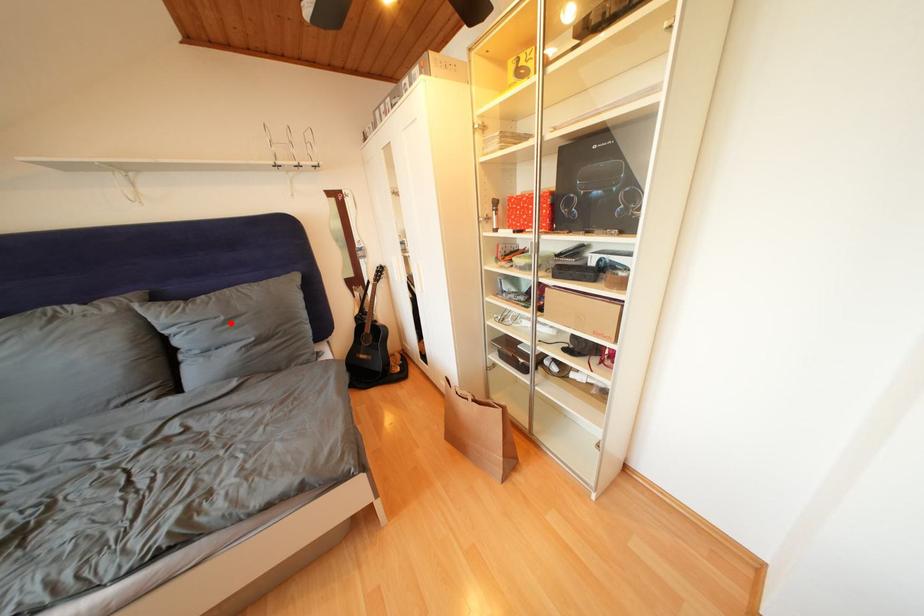
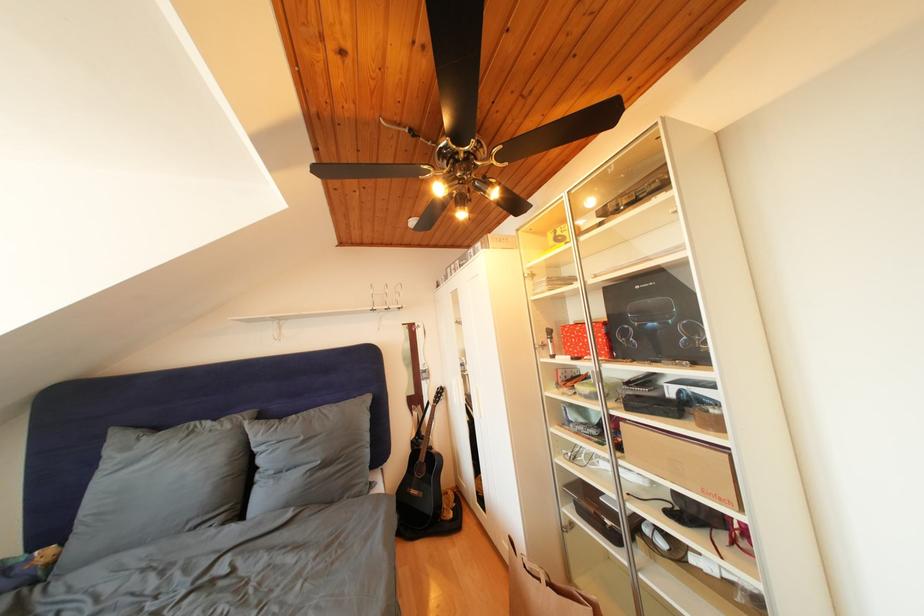
In the second image, find the point that corresponds to the highlighted location in the first image.

(310, 444)